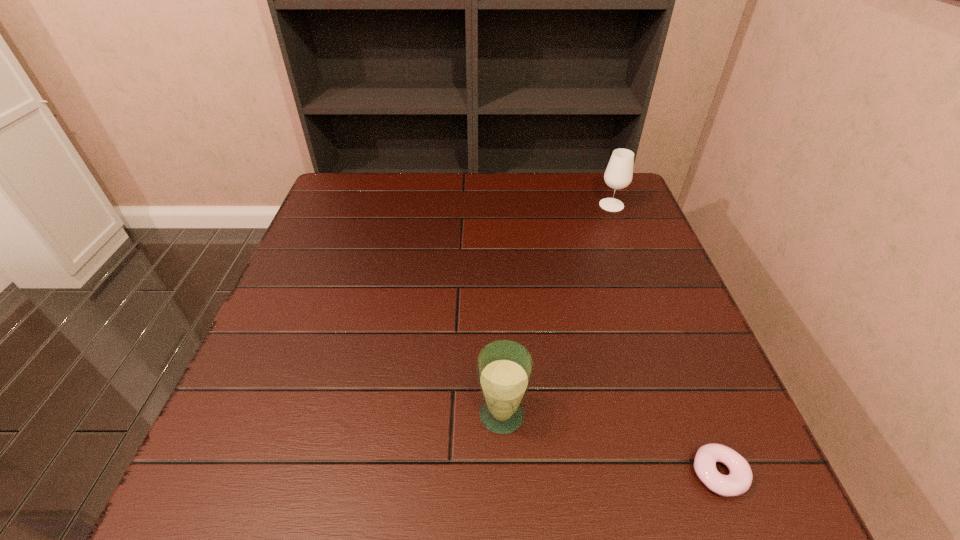
Image resolution: width=960 pixels, height=540 pixels. What are the coordinates of `the farther glass` in the screenshot? It's located at (618, 175).

Locate an element on the screen. the right glass is located at coordinates (618, 175).

At what (x,y) coordinates should I click in order to perform the action: click on the leftmost object. Please return your answer as a coordinate pair (x, y). This screenshot has height=540, width=960. Looking at the image, I should click on (504, 368).

The width and height of the screenshot is (960, 540). Find the location of `the second nearest object`. the second nearest object is located at coordinates (504, 368).

Locate an element on the screen. The width and height of the screenshot is (960, 540). the shortest object is located at coordinates (738, 481).

I want to click on the nearest object, so click(738, 481).

Where is `vacant area situated 0.240m on the front of the right glass`? Image resolution: width=960 pixels, height=540 pixels. vacant area situated 0.240m on the front of the right glass is located at coordinates (636, 268).

What are the coordinates of `free space located 0.050m on the right of the left glass` in the screenshot? It's located at (555, 414).

At what (x,y) coordinates should I click in order to perform the action: click on free space located 0.150m on the left of the doughnut. Please return your answer as a coordinate pair (x, y). Image resolution: width=960 pixels, height=540 pixels. Looking at the image, I should click on (601, 474).

Find the location of a particular element. object situated at the far edge is located at coordinates (618, 175).